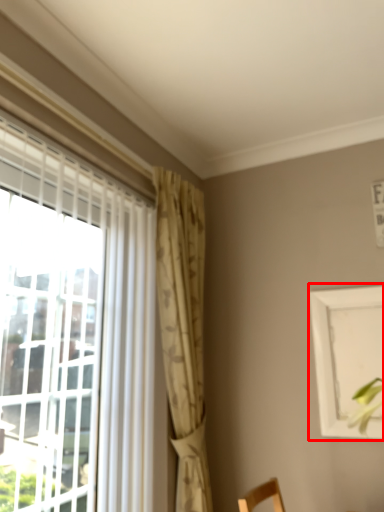
Question: From the image's perspective, what is the correct spatial positioning of picture frame (annotated by the red box) in reference to curtain?

Choices:
 (A) above
 (B) below

Answer: (B)